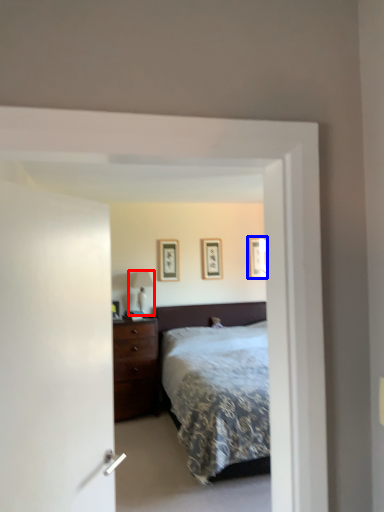
Question: Which object appears closest to the camera in this image, table lamp (highlighted by a red box) or picture frame (highlighted by a blue box)?

Choices:
 (A) table lamp
 (B) picture frame

Answer: (A)